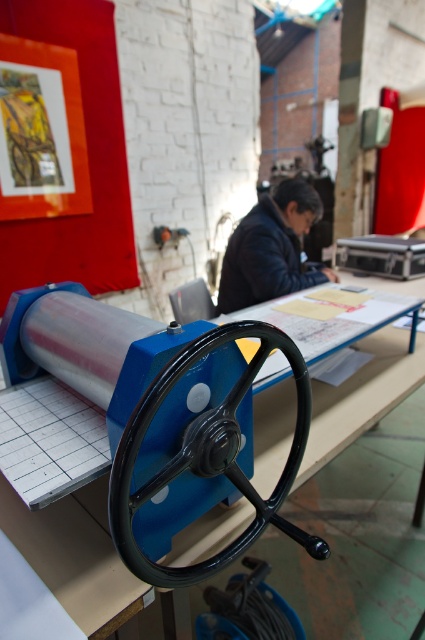
Looking at this image, you are organizing a small event and need to place a dark blue leather jacket at upper center on the blue plastic table at center. Will the jacket fit on the table?

The blue plastic table at center is wider than the dark blue leather jacket at upper center, so the jacket will fit on the table.

You are a maintenance worker who needs to reach the black polished wheel at center and the blue plastic table at center. The tools you have are 20 centimeters long. Can you use them to reach both objects without moving closer?

The distance between the black polished wheel at center and the blue plastic table at center is 22.17 centimeters. Since the tools are only 20 centimeters long, they are too short to reach both objects from your current position without moving closer.

You are organizing a small event in this workspace and need to place a 1.5 meter long banner on one of the objects. Given the blue plastic table at center and the dark blue leather jacket at upper center, which object can accommodate the banner without folding it?

The blue plastic table at center is larger in size than the dark blue leather jacket at upper center, so the banner can be placed on the blue plastic table at center without folding.